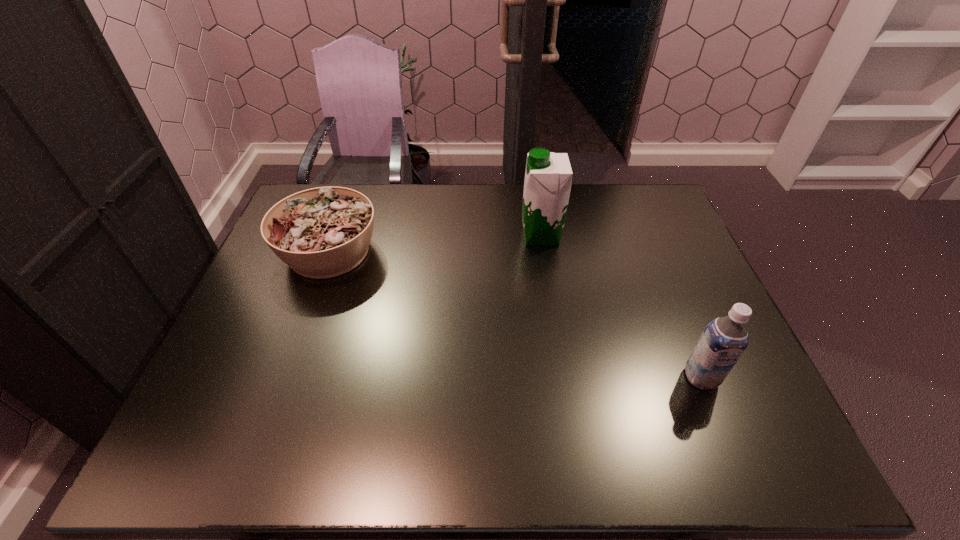
Identify the location of vacant space that is in between the salad and the shorter soya milk. The height and width of the screenshot is (540, 960). (515, 314).

Locate which object is the closest to the salad. Please provide its 2D coordinates. Your answer should be formatted as a tuple, i.e. [(x, y)], where the tuple contains the x and y coordinates of a point satisfying the conditions above.

[(548, 176)]

Identify the location of object that is the second closest to the taller soya milk. (724, 339).